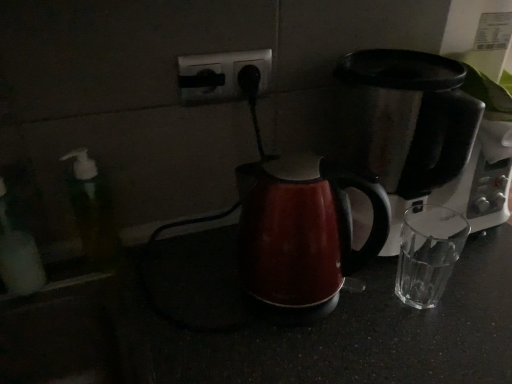
Question: Can you confirm if black plastic outlet at center is taller than translucent plastic soap dispenser at left?

Choices:
 (A) no
 (B) yes

Answer: (A)

Question: Could you tell me if black plastic outlet at center is turned towards translucent plastic soap dispenser at left?

Choices:
 (A) yes
 (B) no

Answer: (B)

Question: Is black plastic outlet at center smaller than translucent plastic soap dispenser at left?

Choices:
 (A) yes
 (B) no

Answer: (A)

Question: From a real-world perspective, does black plastic outlet at center sit lower than translucent plastic soap dispenser at left?

Choices:
 (A) yes
 (B) no

Answer: (B)

Question: Does black plastic outlet at center have a larger size compared to translucent plastic soap dispenser at left?

Choices:
 (A) no
 (B) yes

Answer: (A)

Question: In the image, is stainless steel coffee maker at right on the left side or the right side of black plastic outlet at center?

Choices:
 (A) right
 (B) left

Answer: (A)

Question: Considering the positions of stainless steel coffee maker at right and black plastic outlet at center in the image, is stainless steel coffee maker at right bigger or smaller than black plastic outlet at center?

Choices:
 (A) big
 (B) small

Answer: (A)

Question: From the image's perspective, relative to black plastic outlet at center, is stainless steel coffee maker at right above or below?

Choices:
 (A) below
 (B) above

Answer: (A)

Question: In the image, is stainless steel coffee maker at right positioned in front of or behind black plastic outlet at center?

Choices:
 (A) behind
 (B) front

Answer: (B)

Question: From a real-world perspective, is black plastic outlet at center positioned above or below stainless steel coffee maker at right?

Choices:
 (A) above
 (B) below

Answer: (A)

Question: Is black plastic outlet at center wider or thinner than stainless steel coffee maker at right?

Choices:
 (A) wide
 (B) thin

Answer: (B)

Question: In the image, is black plastic outlet at center positioned in front of or behind stainless steel coffee maker at right?

Choices:
 (A) behind
 (B) front

Answer: (A)

Question: From their relative heights in the image, would you say black plastic outlet at center is taller or shorter than stainless steel coffee maker at right?

Choices:
 (A) tall
 (B) short

Answer: (B)

Question: Is stainless steel coffee maker at right bigger or smaller than translucent plastic soap dispenser at left?

Choices:
 (A) big
 (B) small

Answer: (A)

Question: Considering the relative positions of stainless steel coffee maker at right and translucent plastic soap dispenser at left in the image provided, is stainless steel coffee maker at right to the left or to the right of translucent plastic soap dispenser at left?

Choices:
 (A) right
 (B) left

Answer: (A)